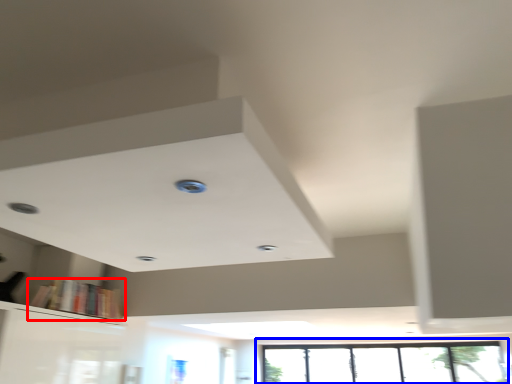
Question: Which object is further to the camera taking this photo, book (highlighted by a red box) or window (highlighted by a blue box)?

Choices:
 (A) book
 (B) window

Answer: (B)